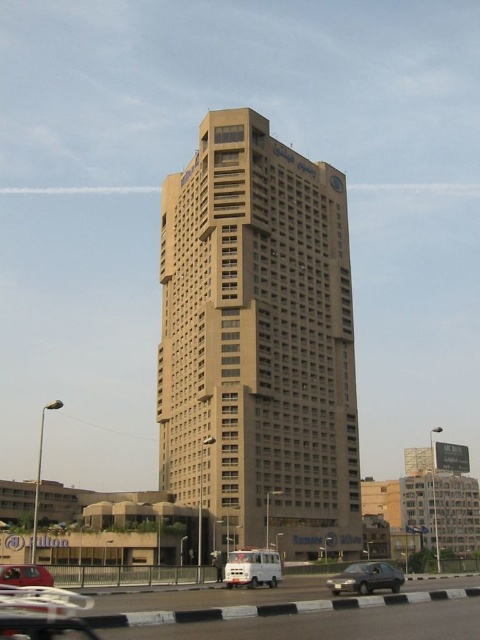
Is white matte van at center smaller than matte red car at lower left?

Actually, white matte van at center might be larger than matte red car at lower left.

Does white matte van at center come behind matte red car at lower left?

That is True.

At what (x,y) coordinates should I click in order to perform the action: click on white matte van at center. Please return your answer as a coordinate pair (x, y). This screenshot has width=480, height=640. Looking at the image, I should click on (252, 566).

Can you confirm if white matte van at center is shorter than dark gray metallic car at lower center?

Yes, white matte van at center is shorter than dark gray metallic car at lower center.

Is white matte van at center bigger than dark gray metallic car at lower center?

No, white matte van at center is not bigger than dark gray metallic car at lower center.

You are a GUI agent. You are given a task and a screenshot of the screen. Output one action in this format:
    pyautogui.click(x=<x>, y=<y>)
    Task: Click on the white matte van at center
    
    Given the screenshot: What is the action you would take?
    pyautogui.click(x=252, y=566)

Does point (241, 220) come behind point (355, 576)?

Yes, point (241, 220) is farther from viewer.

Measure the distance between beige concrete building at center and camera.

beige concrete building at center and camera are 66.53 meters apart.

What do you see at coordinates (259, 342) in the screenshot?
I see `beige concrete building at center` at bounding box center [259, 342].

What are the coordinates of `beige concrete building at center` in the screenshot? It's located at (259, 342).